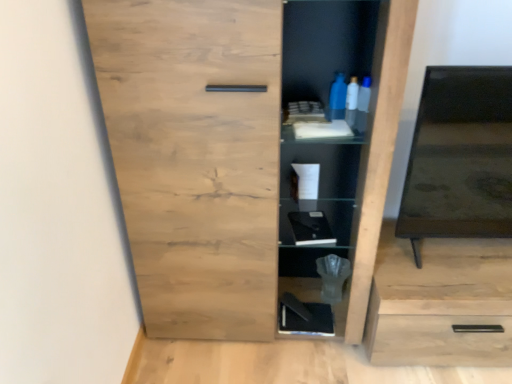
The width and height of the screenshot is (512, 384). I want to click on free space in front of black glossy tv at right, so click(x=474, y=285).